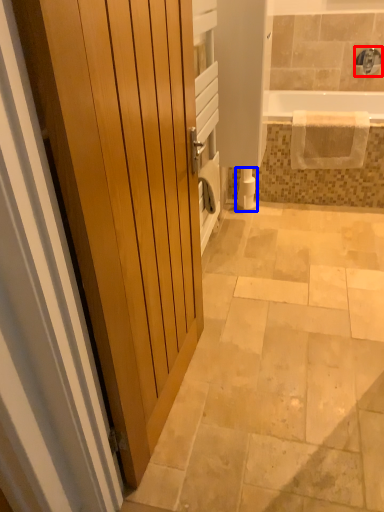
Question: Which object appears farthest to the camera in this image, faucet (highlighted by a red box) or toilet paper (highlighted by a blue box)?

Choices:
 (A) faucet
 (B) toilet paper

Answer: (A)